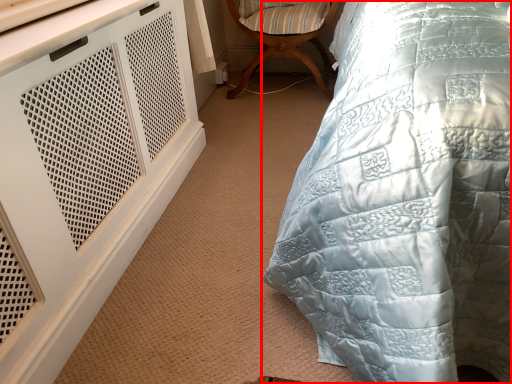
Question: From the image's perspective, what is the correct spatial relationship of bed (annotated by the red box) in relation to chair?

Choices:
 (A) below
 (B) above

Answer: (A)